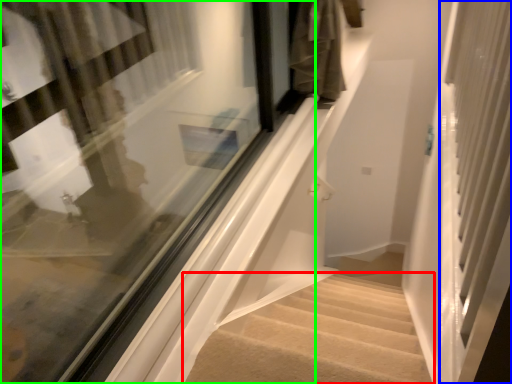
Question: Based on their relative distances, which object is farther from stairs (highlighted by a red box)? Choose from screen door (highlighted by a blue box) and window (highlighted by a green box).

Choices:
 (A) screen door
 (B) window

Answer: (B)